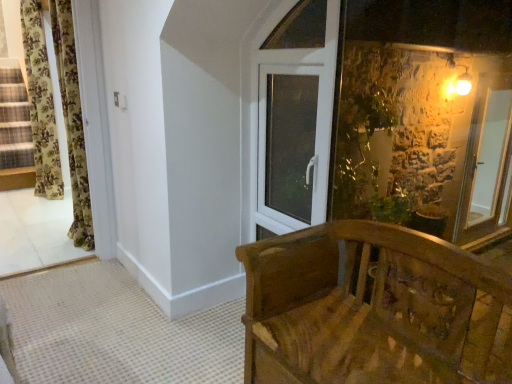
Question: Would you say wooden carved bench at lower right is outside floral fabric curtain at left, which is the first curtain from right to left?

Choices:
 (A) no
 (B) yes

Answer: (B)

Question: From the image's perspective, does wooden carved bench at lower right appear higher than floral fabric curtain at left, marked as the second curtain in a back-to-front arrangement?

Choices:
 (A) no
 (B) yes

Answer: (A)

Question: Is wooden carved bench at lower right with floral fabric curtain at left, arranged as the 2th curtain when viewed from the left?

Choices:
 (A) yes
 (B) no

Answer: (B)

Question: Considering the relative sizes of wooden carved bench at lower right and floral fabric curtain at left, the 1th curtain in the front-to-back sequence, in the image provided, is wooden carved bench at lower right bigger than floral fabric curtain at left, the 1th curtain in the front-to-back sequence,?

Choices:
 (A) no
 (B) yes

Answer: (B)

Question: Is floral fabric curtain at left, marked as the second curtain in a back-to-front arrangement, at the back of wooden carved bench at lower right?

Choices:
 (A) yes
 (B) no

Answer: (B)

Question: Can you confirm if wooden carved bench at lower right is positioned to the right of floral fabric curtain at left, the 1th curtain in the front-to-back sequence?

Choices:
 (A) yes
 (B) no

Answer: (A)

Question: Can you confirm if floral fabric curtain at left, the second curtain viewed from the right, is smaller than white plastic window at upper center?

Choices:
 (A) no
 (B) yes

Answer: (A)

Question: From the image's perspective, is floral fabric curtain at left, arranged as the first curtain when viewed from the left, over white plastic window at upper center?

Choices:
 (A) no
 (B) yes

Answer: (B)

Question: Is floral fabric curtain at left, positioned as the 1th curtain in back-to-front order, taller than white plastic window at upper center?

Choices:
 (A) yes
 (B) no

Answer: (A)

Question: From the image's perspective, would you say floral fabric curtain at left, the second curtain viewed from the right, is shown under white plastic window at upper center?

Choices:
 (A) yes
 (B) no

Answer: (B)

Question: Can we say floral fabric curtain at left, positioned as the 1th curtain in back-to-front order, lies outside white plastic window at upper center?

Choices:
 (A) yes
 (B) no

Answer: (A)

Question: From a real-world perspective, is floral fabric curtain at left, arranged as the first curtain when viewed from the left, on white plastic window at upper center?

Choices:
 (A) no
 (B) yes

Answer: (B)

Question: Is floral fabric curtain at left, arranged as the 2th curtain when viewed from the left, located outside floral fabric curtain at left, which is the second curtain from front to back?

Choices:
 (A) yes
 (B) no

Answer: (A)